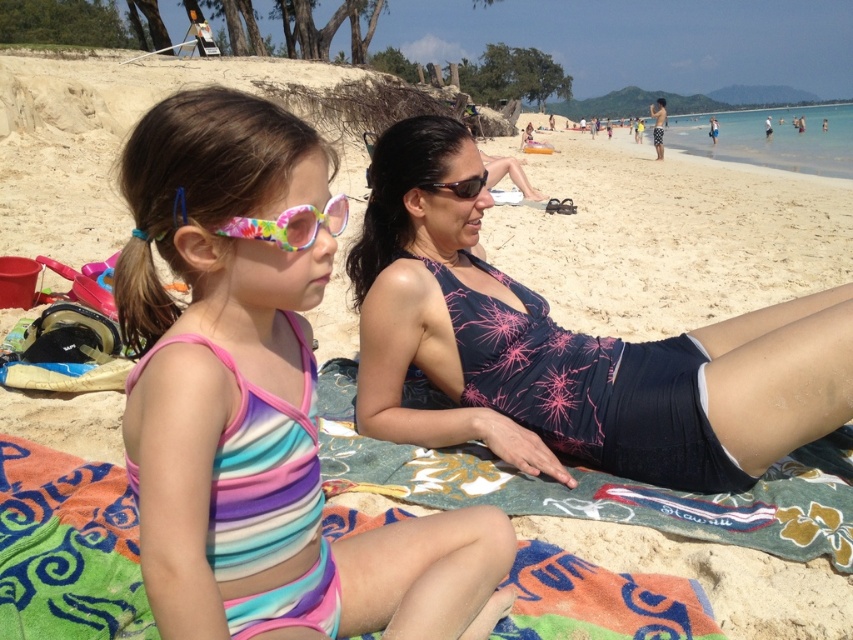
You are a photographer trying to capture a photo of the dark blue swimsuit at center and the multicolored fabric towel at center. Which object should you focus on first if you want to include both in the frame without moving the camera?

The dark blue swimsuit at center is taller than the multicolored fabric towel at center, so you should focus on the dark blue swimsuit at center first to ensure it fits within the frame.

You are a photographer trying to capture both the striped fabric swimsuit at center and the dark blue swimsuit at center in a single shot. Which swimsuit should you focus on first to ensure both are in frame?

The striped fabric swimsuit at center has a lesser height compared to the dark blue swimsuit at center, so you should focus on the dark blue swimsuit at center first to ensure both are in frame.